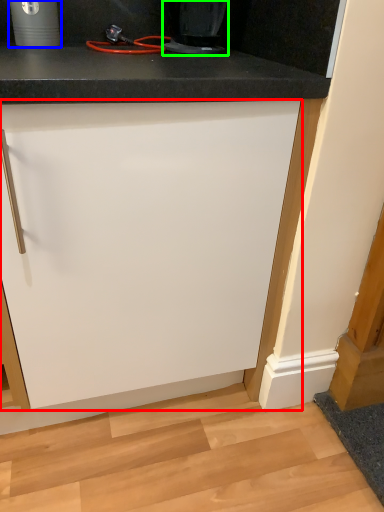
Question: Considering the real-world distances, which object is closest to cabinetry (highlighted by a red box)? appliance (highlighted by a blue box) or home appliance (highlighted by a green box).

Choices:
 (A) appliance
 (B) home appliance

Answer: (B)